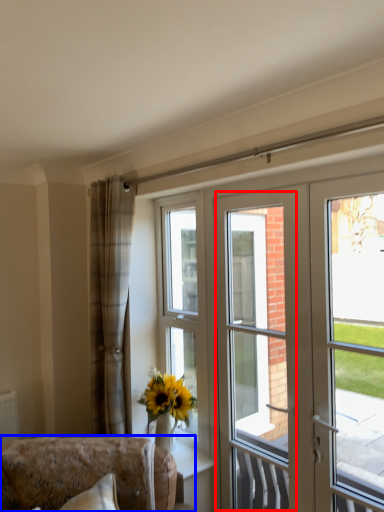
Question: Which point is further to the camera, screen door (highlighted by a red box) or furniture (highlighted by a blue box)?

Choices:
 (A) screen door
 (B) furniture

Answer: (A)